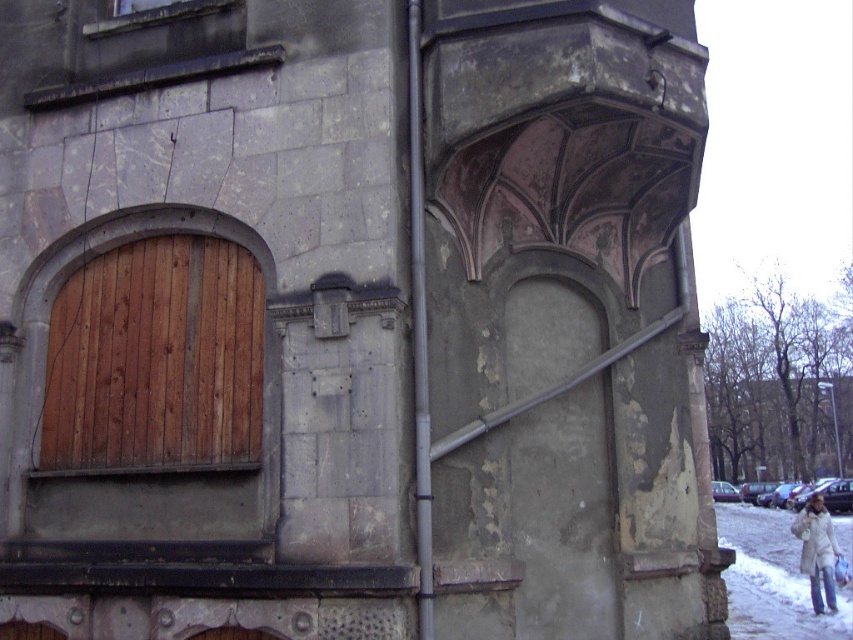
You are standing in front of an old building and see a wooden at left and a white fuzzy coat at lower right. Which object is located higher up?

The wooden at left is positioned over the white fuzzy coat at lower right, so it is higher up.

You are standing in front of an old building and see two points marked on its facade. The first point is at coordinates point (247,371) and the second is at point (815,579). Which point is closer to you?

Point (247,371) is closer to the viewer than point (815,579).